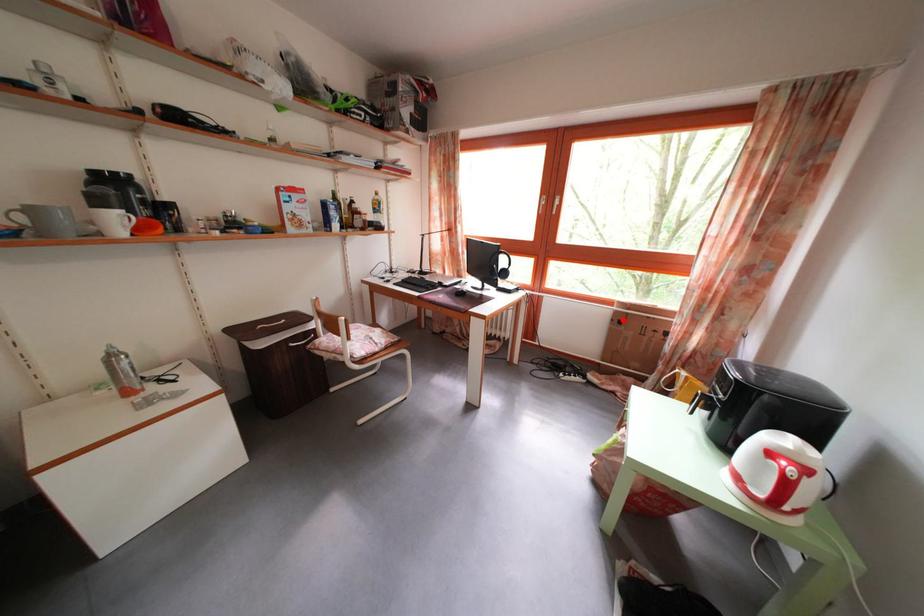
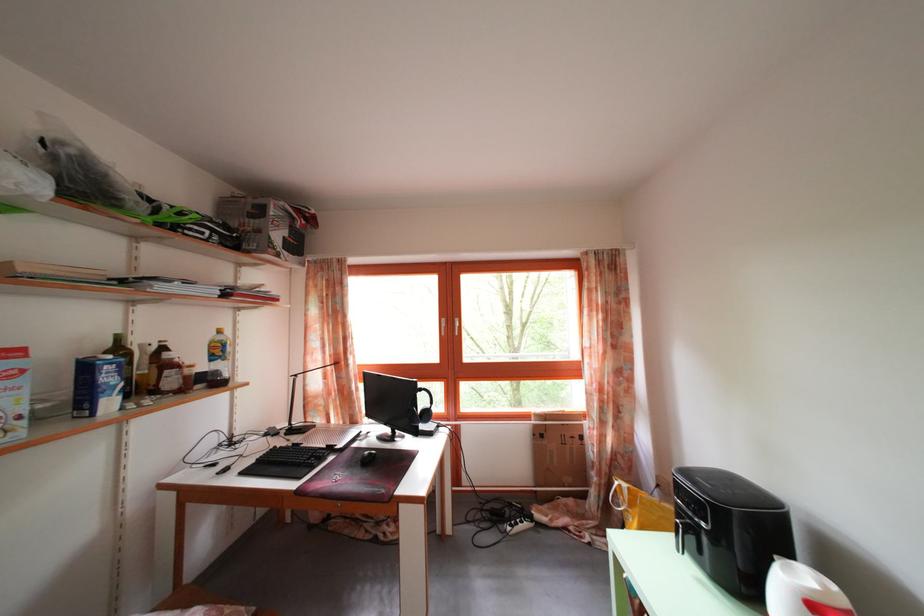
Question: I am providing you with two images of the same scene from different viewpoints. Image1 has a red point marked. In image2, the corresponding 3D location appears at what relative position? Reply with the corresponding letter.

Choices:
 (A) Closer
 (B) Farther

Answer: (B)